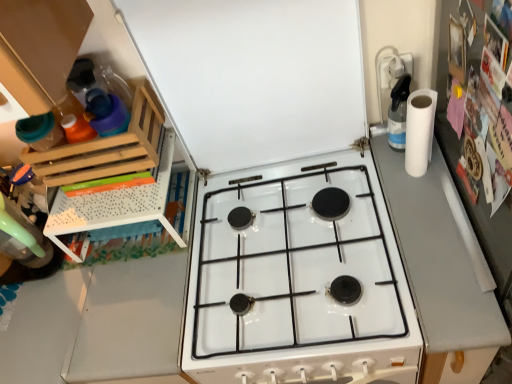
Question: Is white matte paper towel at right at the left side of white matte exhaust hood at upper center?

Choices:
 (A) no
 (B) yes

Answer: (A)

Question: Considering the relative positions of white matte paper towel at right and white matte exhaust hood at upper center in the image provided, is white matte paper towel at right behind white matte exhaust hood at upper center?

Choices:
 (A) yes
 (B) no

Answer: (A)

Question: Is white matte paper towel at right wider than white matte exhaust hood at upper center?

Choices:
 (A) no
 (B) yes

Answer: (B)

Question: Is white matte paper towel at right not inside white matte exhaust hood at upper center?

Choices:
 (A) yes
 (B) no

Answer: (A)

Question: Does white matte paper towel at right have a smaller size compared to white matte exhaust hood at upper center?

Choices:
 (A) yes
 (B) no

Answer: (A)

Question: Considering the relative sizes of white matte paper towel at right and white matte exhaust hood at upper center in the image provided, is white matte paper towel at right taller than white matte exhaust hood at upper center?

Choices:
 (A) yes
 (B) no

Answer: (B)

Question: Is clear plastic spray bottle at upper right facing towards gray matte counter top at right?

Choices:
 (A) yes
 (B) no

Answer: (B)

Question: From the image's perspective, is clear plastic spray bottle at upper right under gray matte counter top at right?

Choices:
 (A) no
 (B) yes

Answer: (A)

Question: Is clear plastic spray bottle at upper right facing away from gray matte counter top at right?

Choices:
 (A) yes
 (B) no

Answer: (B)

Question: Is clear plastic spray bottle at upper right far away from gray matte counter top at right?

Choices:
 (A) no
 (B) yes

Answer: (A)

Question: Is clear plastic spray bottle at upper right outside of gray matte counter top at right?

Choices:
 (A) yes
 (B) no

Answer: (A)

Question: Is clear plastic spray bottle at upper right bigger than gray matte counter top at right?

Choices:
 (A) no
 (B) yes

Answer: (A)

Question: Does white matte exhaust hood at upper center come in front of wooden rack at left?

Choices:
 (A) yes
 (B) no

Answer: (A)